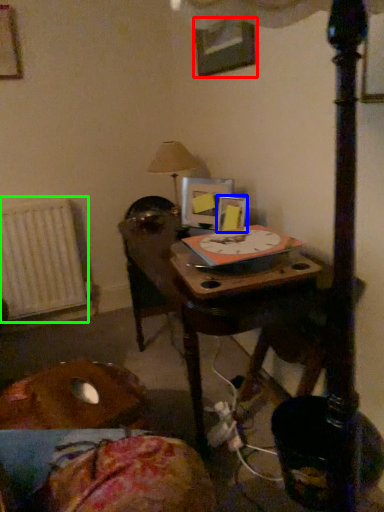
Question: Which object is positioned closest to picture frame (highlighted by a red box)? Select from picture frame (highlighted by a blue box) and radiator (highlighted by a green box).

Choices:
 (A) picture frame
 (B) radiator

Answer: (A)